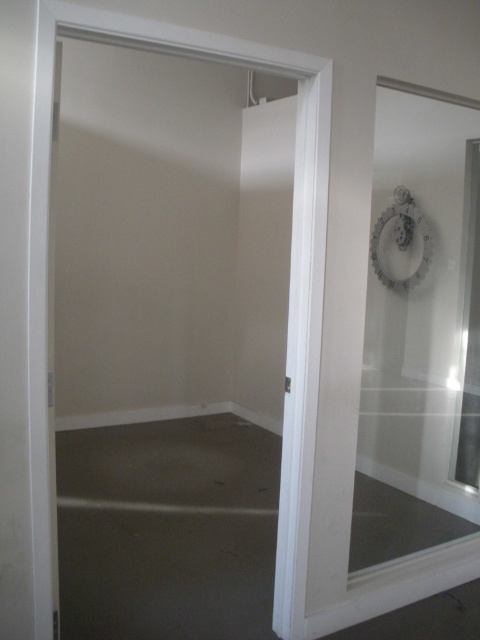
Question: Is white matte door at center to the left of transparent glass door at center from the viewer's perspective?

Choices:
 (A) yes
 (B) no

Answer: (A)

Question: Estimate the real-world distances between objects in this image. Which object is farther from the transparent glass door at center?

Choices:
 (A) white matte door at center
 (B) matte white mirror at upper right

Answer: (B)

Question: Does white matte door at center appear on the left side of matte white mirror at upper right?

Choices:
 (A) no
 (B) yes

Answer: (B)

Question: Which of these objects is positioned closest to the white matte door at center?

Choices:
 (A) matte white mirror at upper right
 (B) transparent glass door at center

Answer: (B)

Question: Which of these objects is positioned farthest from the matte white mirror at upper right?

Choices:
 (A) white matte door at center
 (B) transparent glass door at center

Answer: (B)

Question: Considering the relative positions of transparent glass door at center and matte white mirror at upper right in the image provided, where is transparent glass door at center located with respect to matte white mirror at upper right?

Choices:
 (A) below
 (B) above

Answer: (A)